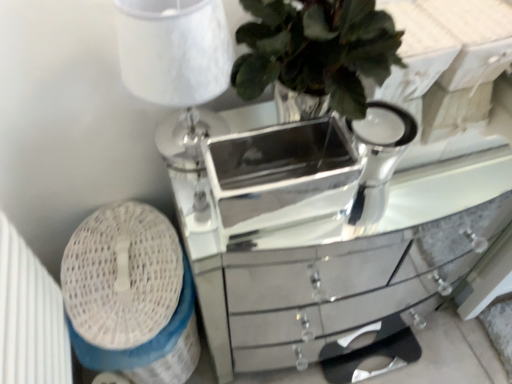
Measure the distance between mirrored silver chest of drawers at center and camera.

mirrored silver chest of drawers at center and camera are 27.48 inches apart.

In order to face silver/metallic mirrored tray at center, should I rotate leftwards or rightwards?

It's best to rotate right around 2.954 degrees.

Image resolution: width=512 pixels, height=384 pixels. What do you see at coordinates (177, 68) in the screenshot? I see `white textured lampshade at upper left` at bounding box center [177, 68].

The image size is (512, 384). What are the coordinates of `mirrored silver chest of drawers at center` in the screenshot? It's located at (313, 257).

Where is `appliance below the white textured lampshade at upper left (from the image's perspective)`? The image size is (512, 384). appliance below the white textured lampshade at upper left (from the image's perspective) is located at coordinates (282, 174).

Considering the positions of objects silver/metallic mirrored tray at center and white textured lampshade at upper left in the image provided, who is more to the left, silver/metallic mirrored tray at center or white textured lampshade at upper left?

white textured lampshade at upper left.

From a real-world perspective, which is physically below, silver/metallic mirrored tray at center or white textured lampshade at upper left?

In real-world perspective, silver/metallic mirrored tray at center is lower.

Between silver/metallic mirrored tray at center and white textured lampshade at upper left, which one has less height?

With less height is silver/metallic mirrored tray at center.

I want to click on the chest of drawers that is below the white textured lampshade at upper left (from the image's perspective), so click(313, 257).

Considering the positions of objects white textured lampshade at upper left and mirrored silver chest of drawers at center in the image provided, who is behind, white textured lampshade at upper left or mirrored silver chest of drawers at center?

mirrored silver chest of drawers at center.

Does point (127, 38) come in front of point (279, 297)?

Yes, point (127, 38) is closer to viewer.

From a real-world perspective, is white textured lampshade at upper left beneath mirrored silver chest of drawers at center?

Actually, white textured lampshade at upper left is physically above mirrored silver chest of drawers at center in the real world.

From a real-world perspective, who is located higher, white textured lampshade at upper left or silver/metallic mirrored tray at center?

white textured lampshade at upper left is physically above.

Is white textured lampshade at upper left in front of or behind silver/metallic mirrored tray at center in the image?

white textured lampshade at upper left is in front of silver/metallic mirrored tray at center.

Which is nearer, (x=138, y=34) or (x=323, y=136)?

Point (x=138, y=34)

Considering the positions of point (264, 205) and point (257, 277), is point (264, 205) closer or farther from the camera than point (257, 277)?

Point (264, 205) appears to be farther away from the viewer than point (257, 277).

How different are the orientations of silver/metallic mirrored tray at center and mirrored silver chest of drawers at center in degrees?

They differ by 2.76 degrees in their facing directions.

Can we say silver/metallic mirrored tray at center lies outside mirrored silver chest of drawers at center?

Yes, silver/metallic mirrored tray at center is not within mirrored silver chest of drawers at center.

In the image, is silver/metallic mirrored tray at center positioned in front of or behind mirrored silver chest of drawers at center?

Visually, silver/metallic mirrored tray at center is located in front of mirrored silver chest of drawers at center.

Is the depth of mirrored silver chest of drawers at center less than that of white textured lampshade at upper left?

No, mirrored silver chest of drawers at center is further to the viewer.

Could you tell me if mirrored silver chest of drawers at center is turned towards white textured lampshade at upper left?

No, mirrored silver chest of drawers at center is not turned towards white textured lampshade at upper left.

Can white textured lampshade at upper left be found inside mirrored silver chest of drawers at center?

No, white textured lampshade at upper left is not inside mirrored silver chest of drawers at center.

From a real-world perspective, is mirrored silver chest of drawers at center positioned above or below silver/metallic mirrored tray at center?

Clearly, from a real-world perspective, mirrored silver chest of drawers at center is below silver/metallic mirrored tray at center.

Would you say mirrored silver chest of drawers at center contains silver/metallic mirrored tray at center?

No.

Is the depth of mirrored silver chest of drawers at center less than that of silver/metallic mirrored tray at center?

No, it is not.

Between mirrored silver chest of drawers at center and silver/metallic mirrored tray at center, which one has larger width?

mirrored silver chest of drawers at center.

In order to click on appliance that appears below the white textured lampshade at upper left (from the image's perspective) in this screenshot , I will do `click(282, 174)`.

Where is `chest of drawers on the right side of white textured lampshade at upper left`? The width and height of the screenshot is (512, 384). chest of drawers on the right side of white textured lampshade at upper left is located at coordinates (313, 257).

Considering their positions, is silver/metallic mirrored tray at center positioned further to white textured lampshade at upper left than mirrored silver chest of drawers at center?

The object further to white textured lampshade at upper left is silver/metallic mirrored tray at center.

Which object lies nearer to the anchor point mirrored silver chest of drawers at center, white textured lampshade at upper left or silver/metallic mirrored tray at center?

white textured lampshade at upper left is closer to mirrored silver chest of drawers at center.

Which object lies further to the anchor point silver/metallic mirrored tray at center, mirrored silver chest of drawers at center or white textured lampshade at upper left?

white textured lampshade at upper left is positioned further to the anchor silver/metallic mirrored tray at center.

When comparing their distances from mirrored silver chest of drawers at center, does silver/metallic mirrored tray at center or white textured lampshade at upper left seem closer?

Among the two, white textured lampshade at upper left is located nearer to mirrored silver chest of drawers at center.

Consider the image. Estimate the real-world distances between objects in this image. Which object is closer to white textured lampshade at upper left, mirrored silver chest of drawers at center or silver/metallic mirrored tray at center?

mirrored silver chest of drawers at center.

From the image, which object appears to be nearer to silver/metallic mirrored tray at center, white textured lampshade at upper left or mirrored silver chest of drawers at center?

The object closer to silver/metallic mirrored tray at center is mirrored silver chest of drawers at center.

Locate an element on the screen. This screenshot has width=512, height=384. appliance between white textured lampshade at upper left and mirrored silver chest of drawers at center in the horizontal direction is located at coordinates (282, 174).